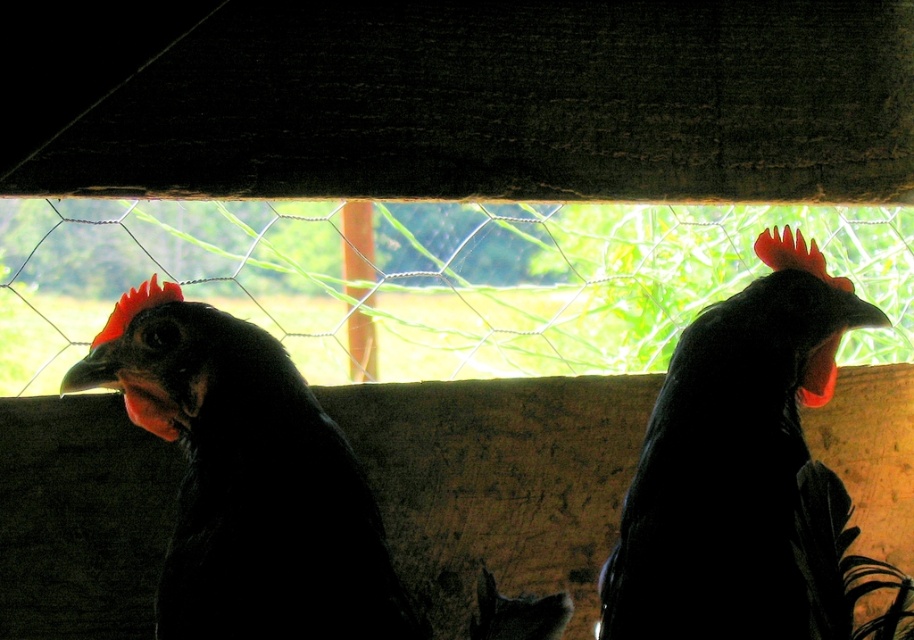
Question: Can you confirm if matte black chicken at left is positioned to the right of black glossy rooster at center?

Choices:
 (A) no
 (B) yes

Answer: (A)

Question: Does matte black chicken at left have a greater width compared to black glossy rooster at center?

Choices:
 (A) no
 (B) yes

Answer: (B)

Question: Which of the following is the closest to the observer?

Choices:
 (A) (679, 374)
 (B) (177, 408)

Answer: (B)

Question: Does matte black chicken at left appear on the left side of black glossy rooster at center?

Choices:
 (A) no
 (B) yes

Answer: (B)